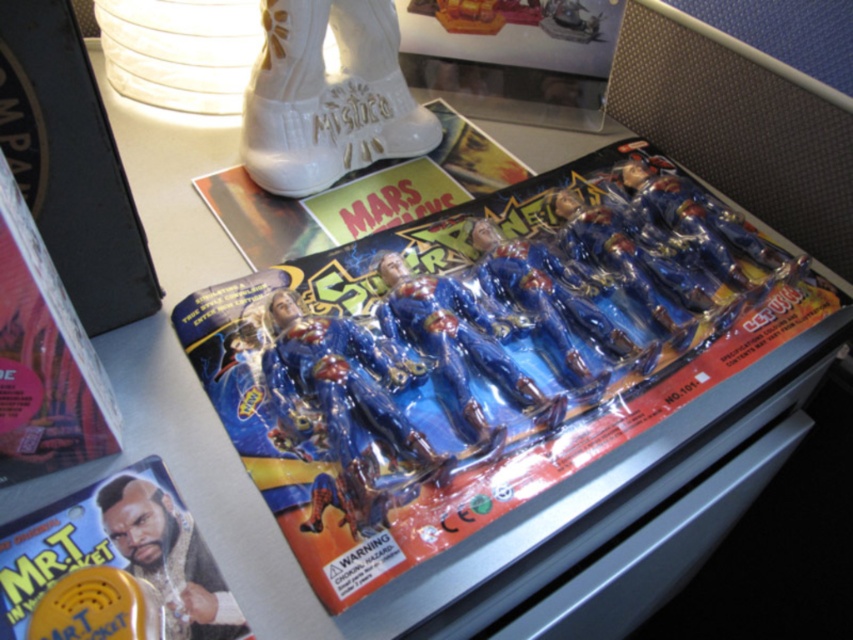
You are organizing a comic book display and need to arrange the blue plastic comic book at center and the matte plastic comic book at lower left on a shelf. Which comic book should you place at the back to ensure both are visible?

The blue plastic comic book at center should be placed at the back because it is much taller than the matte plastic comic book at lower left, allowing both to be visible.

You are organizing a comic book collection on a shelf. You have a blue plastic comic book at center and a matte plastic comic book at lower left. Which one should you place on the left side of the shelf to ensure the wider one is on the right?

The blue plastic comic book at center might be wider than matte plastic comic book at lower left, so you should place the blue plastic comic book at center on the right side and the matte plastic comic book at lower left on the left side to ensure the wider one is on the right.